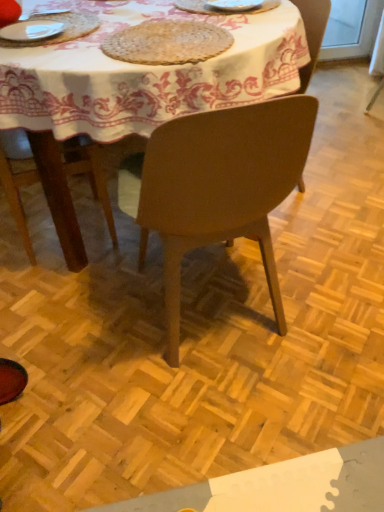
I want to click on vacant area situated below matte brown chair at center, which ranks as the 2th chair in back-to-front order (from a real-world perspective), so click(223, 314).